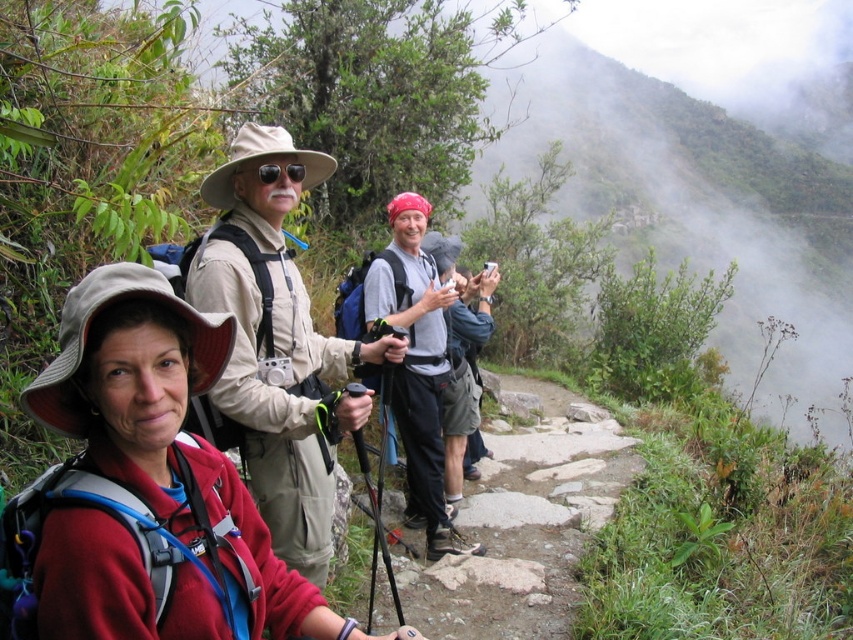
Question: Estimate the real-world distances between objects in this image. Which object is farther from the matte red jacket at center?

Choices:
 (A) black matte sunglasses at center
 (B) gray fabric shirt at center

Answer: (B)

Question: Does matte red jacket at center have a greater width compared to black matte sunglasses at center?

Choices:
 (A) yes
 (B) no

Answer: (A)

Question: Estimate the real-world distances between objects in this image. Which object is farther from the tan fabric hat at center?

Choices:
 (A) gray fabric shirt at center
 (B) matte red jacket at center
 (C) black matte sunglasses at center

Answer: (A)

Question: Is tan fabric hat at center wider than black matte sunglasses at center?

Choices:
 (A) no
 (B) yes

Answer: (B)

Question: Does matte red jacket at center lie in front of tan fabric hat at center?

Choices:
 (A) yes
 (B) no

Answer: (A)

Question: Which of the following is the closest to the observer?

Choices:
 (A) tan fabric hat at center
 (B) gray fabric shirt at center
 (C) black matte sunglasses at center

Answer: (A)